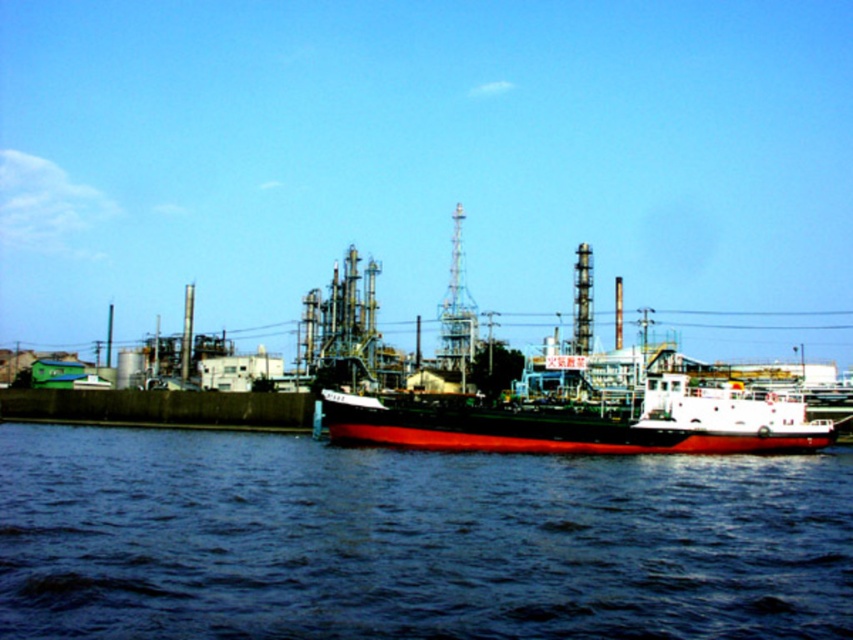
You are a boat operator who needs to navigate a 50 feet long vessel through the dark blue water at center. The shiny black ship at center is anchored in the same area. Can your vessel safely pass by the ship without colliding?

The dark blue water at center is 69.59 feet from the shiny black ship at center. Since your vessel is 50 feet long, there is sufficient space to navigate safely around the ship as the distance between them allows for maneuvering without collision.

You are a photographer planning to capture the waterfront scene. You want to ensure that both the dark blue water at center and the shiny black ship at center are clearly visible in your shot. Given their relative widths, which object should you position closer to the edge of the frame to avoid overcrowding the composition?

The dark blue water at center is wider than the shiny black ship at center. To avoid overcrowding, position the wider dark blue water at center closer to the edge of the frame so that the narrower shiny black ship at center can be centered or given more prominence without the composition feeling too busy.